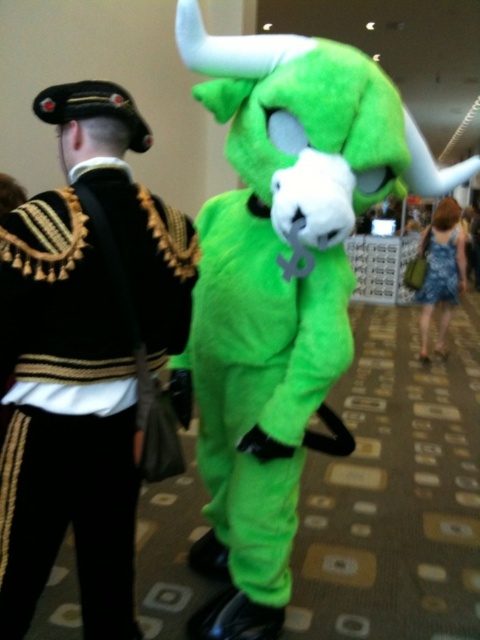
Which of these two, black velvet jacket at upper left or blue fabric dress at center, stands shorter?

Standing shorter between the two is blue fabric dress at center.

Does black velvet jacket at upper left have a greater height compared to blue fabric dress at center?

Indeed, black velvet jacket at upper left has a greater height compared to blue fabric dress at center.

Is point (0, 348) closer to camera compared to point (440, 289)?

Yes, point (0, 348) is closer to viewer.

Find the location of a particular element. The image size is (480, 640). black velvet jacket at upper left is located at coordinates (82, 358).

Is point (435, 189) in front of point (416, 296)?

Yes, it is.

Who is more distant from viewer, [240,417] or [423,298]?

Positioned behind is point [423,298].

Find the location of a particular element. Image resolution: width=480 pixels, height=640 pixels. green fuzzy costume at center is located at coordinates (278, 285).

Is green fuzzy costume at center positioned at the back of black velvet jacket at upper left?

That is True.

I want to click on green fuzzy costume at center, so click(x=278, y=285).

Identify the location of green fuzzy costume at center. Image resolution: width=480 pixels, height=640 pixels. (278, 285).